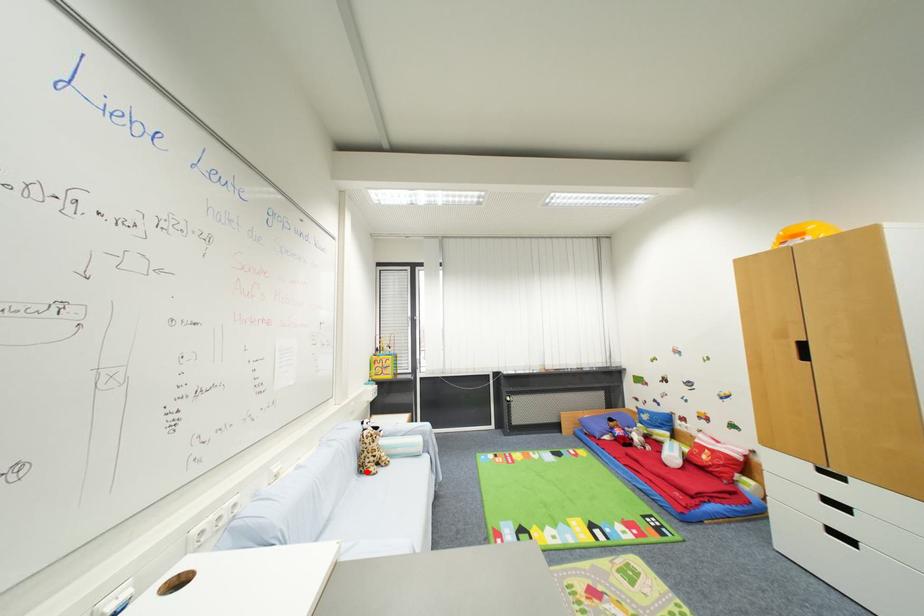
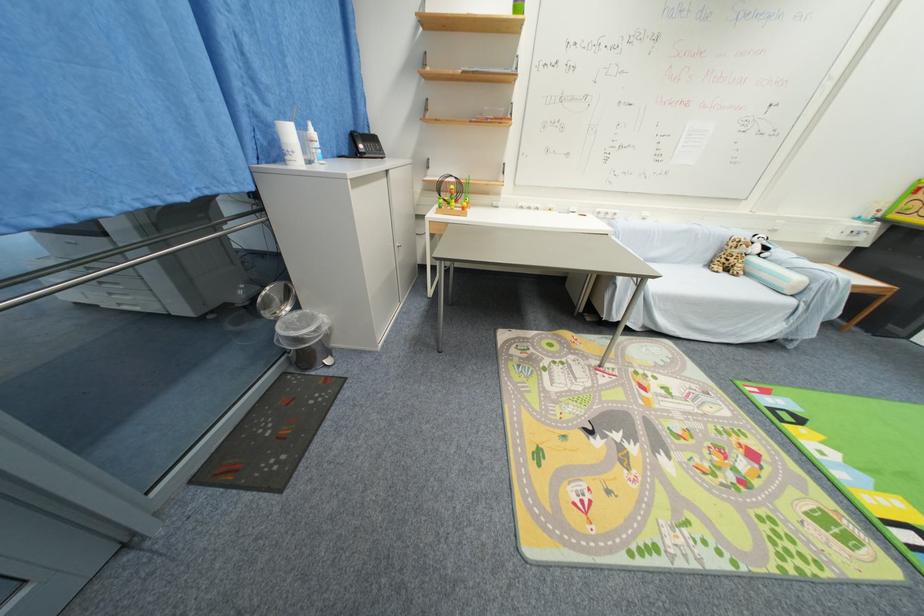
Where in the second image is the point corresponding to the highlighted location from the first image?

(714, 265)